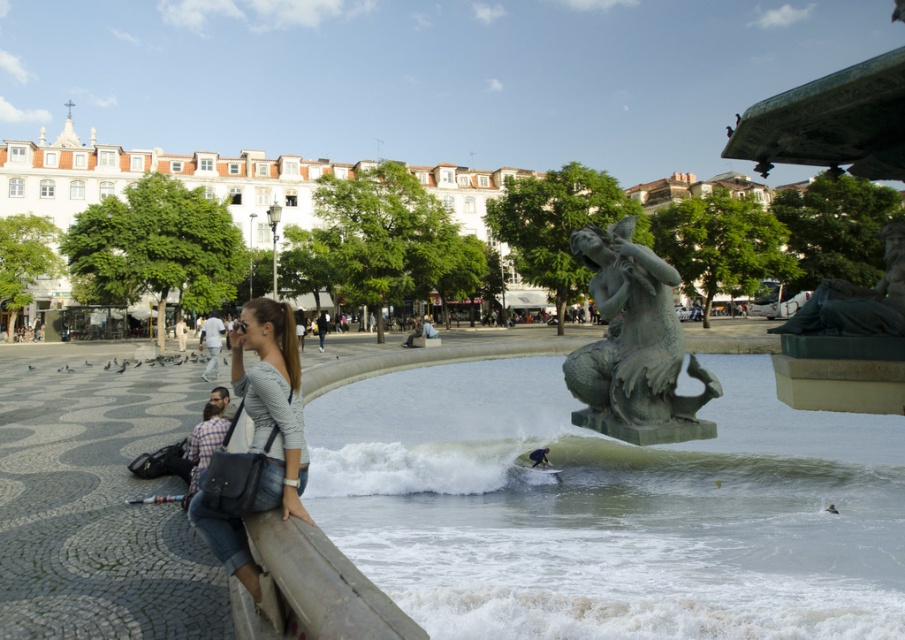
What is located at the coordinates point (634, 346) in the image?

The green patina statue at center is located at point (634, 346).

Consider the image. You are standing at the center of the image and want to locate the green patina statue at center. According to the coordinates provided, in which direction should you move to find it?

The green patina statue at center is located at coordinates point (x=634, y=346), so you should move downward from the center to find it.